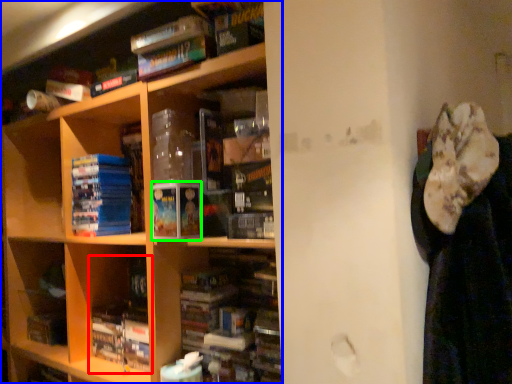
Question: Which is farther away from book (highlighted by a red box)? shelf (highlighted by a blue box) or paperback book (highlighted by a green box)?

Choices:
 (A) shelf
 (B) paperback book

Answer: (B)